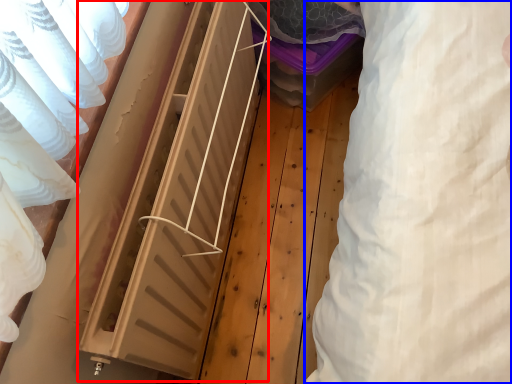
Question: Which of the following is the closest to the observer, radiator (highlighted by a red box) or clothing (highlighted by a blue box)?

Choices:
 (A) radiator
 (B) clothing

Answer: (B)